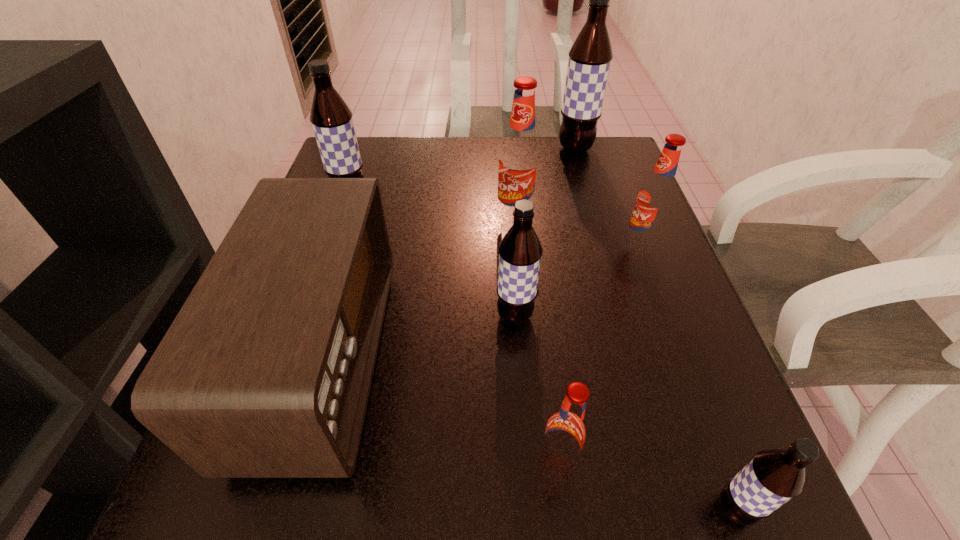
The image size is (960, 540). I want to click on vacant region located 0.250m on the left of the sixth farthest root beer, so (355, 460).

At what (x,y) coordinates should I click in order to perform the action: click on free space located on the left of the smallest brown root beer. Please return your answer as a coordinate pair (x, y). Looking at the image, I should click on tap(427, 509).

The image size is (960, 540). In order to click on radio receiver that is positioned at the near edge in this screenshot , I will do `click(265, 372)`.

Identify the location of root beer present at the left edge. This screenshot has height=540, width=960. (331, 118).

What are the coordinates of `radio receiver located in the left edge section of the desktop` in the screenshot? It's located at (265, 372).

You are a GUI agent. You are given a task and a screenshot of the screen. Output one action in this format:
    pyautogui.click(x=<x>, y=<y>)
    Task: Click on the object that is at the far left corner
    
    Given the screenshot: What is the action you would take?
    pyautogui.click(x=331, y=118)

This screenshot has width=960, height=540. I want to click on object that is at the near left corner, so click(265, 372).

Identify the location of object present at the far right corner. (590, 56).

Image resolution: width=960 pixels, height=540 pixels. In order to click on object that is positioned at the near right corner in this screenshot , I will do `click(774, 476)`.

Find the location of a particular element. vacant space at the far edge is located at coordinates (405, 143).